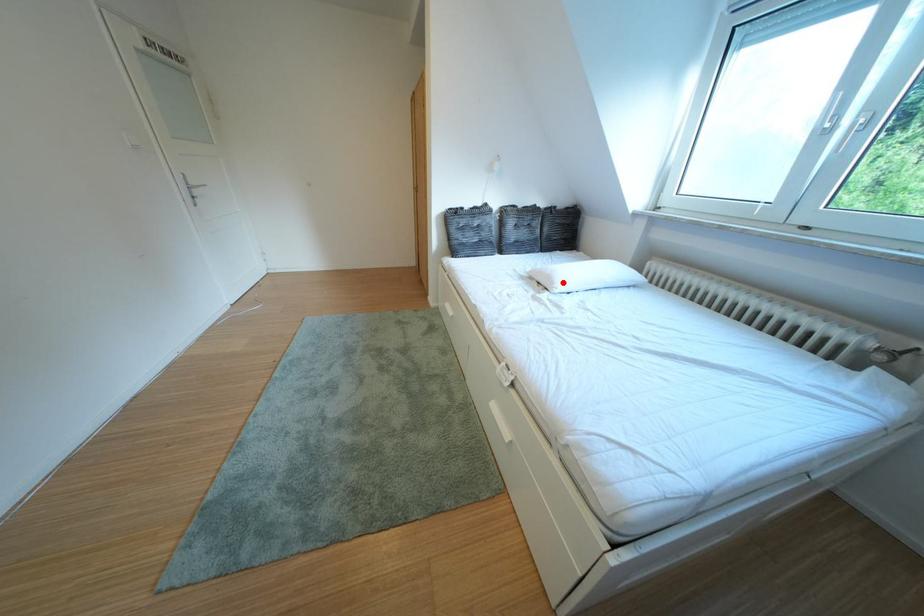
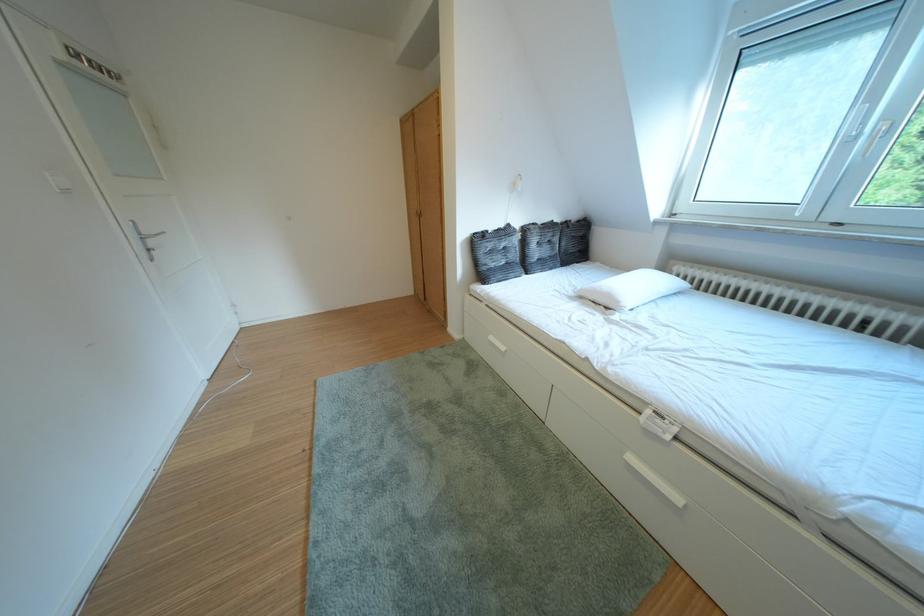
Where in the second image is the point corresponding to the highlighted location from the first image?

(623, 301)